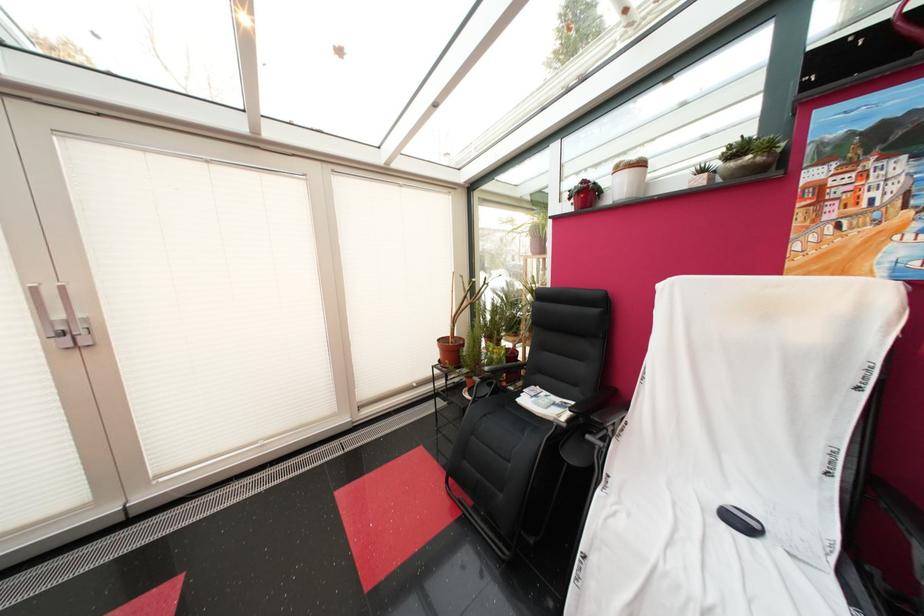
This screenshot has height=616, width=924. What are the coordinates of `chair armrest` in the screenshot? It's located at (606, 434).